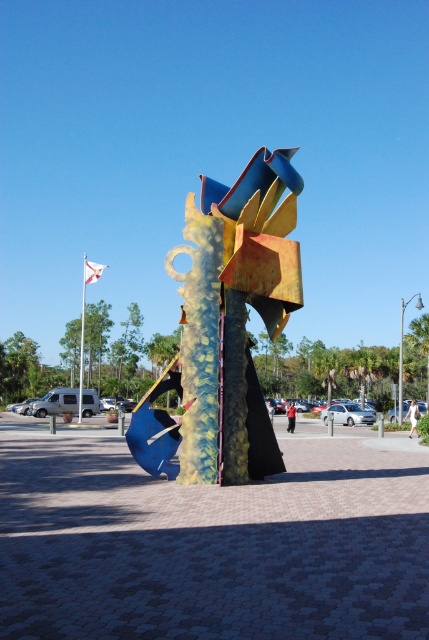
You are standing in the outdoor area and want to take a photo of the metallic blue and yellow abstract sculpture at center and the white flagpole at upper left. Which object should you focus on first to ensure both are in the frame without moving the camera?

You should focus on the metallic blue and yellow abstract sculpture at center first because it is closer to you than the white flagpole at upper left. By focusing on the closer object, the background object will also be in focus if within the depth of field.

You are standing in the outdoor area and see the point marked at coordinates (226,326). What does this point represent in the scene?

The point at (226,326) represents the metallic blue and yellow abstract sculpture at center.

You are standing at point (82,337) in the image. What object is located at this point?

The white flagpole at upper left is located at point (82,337).